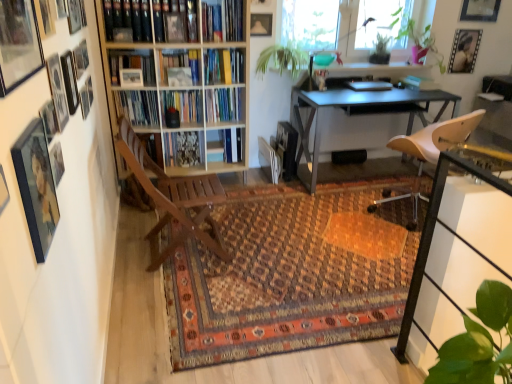
Question: Could you tell me if transparent glass window screen at upper center is facing metallic gray desk at center?

Choices:
 (A) yes
 (B) no

Answer: (B)

Question: From a real-world perspective, is transparent glass window screen at upper center beneath metallic gray desk at center?

Choices:
 (A) no
 (B) yes

Answer: (A)

Question: Considering the relative positions of transparent glass window screen at upper center and metallic gray desk at center in the image provided, is transparent glass window screen at upper center to the right of metallic gray desk at center from the viewer's perspective?

Choices:
 (A) no
 (B) yes

Answer: (A)

Question: Is transparent glass window screen at upper center located outside metallic gray desk at center?

Choices:
 (A) no
 (B) yes

Answer: (B)

Question: Is transparent glass window screen at upper center wider than metallic gray desk at center?

Choices:
 (A) yes
 (B) no

Answer: (B)

Question: Would you say matte black picture frame at upper right, arranged as the 14th picture frame when viewed from the left, is to the left or to the right of wooden bookcase at left in the picture?

Choices:
 (A) right
 (B) left

Answer: (A)

Question: Relative to wooden bookcase at left, is matte black picture frame at upper right, the 2th picture frame positioned from the right, in front or behind?

Choices:
 (A) front
 (B) behind

Answer: (B)

Question: From a real-world perspective, is matte black picture frame at upper right, the 2th picture frame positioned from the right, physically located above or below wooden bookcase at left?

Choices:
 (A) below
 (B) above

Answer: (B)

Question: In terms of width, does matte black picture frame at upper right, which ranks as the first picture frame in back-to-front order, look wider or thinner when compared to wooden bookcase at left?

Choices:
 (A) wide
 (B) thin

Answer: (B)

Question: Based on their sizes in the image, would you say hardcover book at center, the 2th book viewed from the top, is bigger or smaller than wooden picture frame at upper left, the fifteenth picture frame positioned from the back?

Choices:
 (A) small
 (B) big

Answer: (B)

Question: Considering their positions, is hardcover book at center, the 2th book viewed from the top, located in front of or behind wooden picture frame at upper left, the 7th picture frame when ordered from right to left?

Choices:
 (A) front
 (B) behind

Answer: (B)

Question: From a real-world perspective, is hardcover book at center, the 2th book in the bottom-to-top sequence, above or below wooden picture frame at upper left, marked as the first picture frame in a front-to-back arrangement?

Choices:
 (A) above
 (B) below

Answer: (B)

Question: Considering the positions of hardcover book at center, the 2th book in the bottom-to-top sequence, and wooden picture frame at upper left, the fifteenth picture frame positioned from the back, in the image, is hardcover book at center, the 2th book in the bottom-to-top sequence, wider or thinner than wooden picture frame at upper left, the fifteenth picture frame positioned from the back,?

Choices:
 (A) thin
 (B) wide

Answer: (B)

Question: From the image's perspective, is matte black picture frame at upper left, which ranks as the tenth picture frame in back-to-front order, above or below wooden picture frame at upper left, arranged as the 5th picture frame when viewed from the front?

Choices:
 (A) below
 (B) above

Answer: (A)

Question: In terms of height, does matte black picture frame at upper left, the 7th picture frame when ordered from left to right, look taller or shorter compared to wooden picture frame at upper left, the 8th picture frame viewed from the right?

Choices:
 (A) short
 (B) tall

Answer: (B)